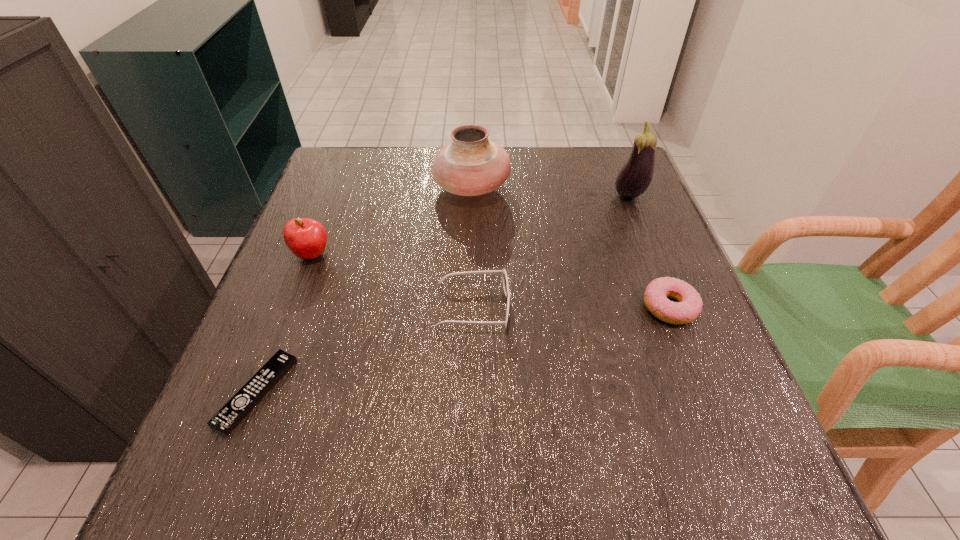
You are a GUI agent. You are given a task and a screenshot of the screen. Output one action in this format:
    pyautogui.click(x=<x>, y=<y>)
    Task: Click on the eggplant
    The width and height of the screenshot is (960, 540).
    Given the screenshot: What is the action you would take?
    pyautogui.click(x=634, y=178)

The image size is (960, 540). I want to click on pottery, so click(470, 165).

Where is `the fourth nearest object`? the fourth nearest object is located at coordinates (306, 238).

Find the location of `apple`. apple is located at coordinates (306, 238).

At what (x,y) coordinates should I click in order to perform the action: click on sunglasses. Please return your answer as a coordinate pair (x, y). The image size is (960, 540). Looking at the image, I should click on (502, 272).

I want to click on doughnut, so click(689, 306).

Locate an element on the screen. the nearest object is located at coordinates (242, 403).

Where is `the shortest object`? the shortest object is located at coordinates (242, 403).

Image resolution: width=960 pixels, height=540 pixels. I want to click on vacant region located 0.160m on the left of the eggplant, so click(x=549, y=196).

The width and height of the screenshot is (960, 540). Find the location of `vacant position located on the front of the second tallest object`. vacant position located on the front of the second tallest object is located at coordinates (468, 326).